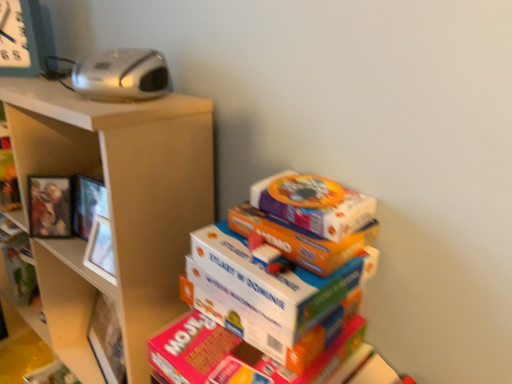
Question: Is wooden shelf at left, the first shelf when ordered from top to bottom, smaller than matte brown shelf at upper left, the 1th shelf ordered from the bottom?

Choices:
 (A) no
 (B) yes

Answer: (B)

Question: Can you confirm if wooden shelf at left, the first shelf when ordered from top to bottom, is shorter than matte brown shelf at upper left, arranged as the 2th shelf when viewed from the top?

Choices:
 (A) yes
 (B) no

Answer: (A)

Question: From the image's perspective, would you say wooden shelf at left, placed as the second shelf when sorted from bottom to top, is shown under matte brown shelf at upper left, arranged as the 2th shelf when viewed from the top?

Choices:
 (A) no
 (B) yes

Answer: (A)

Question: Is wooden shelf at left, the first shelf when ordered from top to bottom, directly adjacent to matte brown shelf at upper left, the 1th shelf ordered from the bottom?

Choices:
 (A) no
 (B) yes

Answer: (A)

Question: Does wooden shelf at left, placed as the second shelf when sorted from bottom to top, contain matte brown shelf at upper left, the 1th shelf ordered from the bottom?

Choices:
 (A) yes
 (B) no

Answer: (B)

Question: Based on their positions, is silver plastic radio at upper left located to the left or right of wooden shelf at left, placed as the second shelf when sorted from bottom to top?

Choices:
 (A) left
 (B) right

Answer: (B)

Question: From the image's perspective, is silver plastic radio at upper left positioned above or below wooden shelf at left, placed as the second shelf when sorted from bottom to top?

Choices:
 (A) below
 (B) above

Answer: (B)

Question: Based on their sizes in the image, would you say silver plastic radio at upper left is bigger or smaller than wooden shelf at left, the first shelf when ordered from top to bottom?

Choices:
 (A) big
 (B) small

Answer: (B)

Question: Choose the correct answer: Is silver plastic radio at upper left inside wooden shelf at left, placed as the second shelf when sorted from bottom to top, or outside it?

Choices:
 (A) outside
 (B) inside

Answer: (A)

Question: Considering the positions of matte brown shelf at upper left, arranged as the 2th shelf when viewed from the top, and wooden shelf at left, placed as the second shelf when sorted from bottom to top, in the image, is matte brown shelf at upper left, arranged as the 2th shelf when viewed from the top, bigger or smaller than wooden shelf at left, placed as the second shelf when sorted from bottom to top,?

Choices:
 (A) small
 (B) big

Answer: (B)

Question: Is matte brown shelf at upper left, arranged as the 2th shelf when viewed from the top, spatially inside wooden shelf at left, the first shelf when ordered from top to bottom, or outside of it?

Choices:
 (A) outside
 (B) inside

Answer: (A)

Question: From the image's perspective, is matte brown shelf at upper left, arranged as the 2th shelf when viewed from the top, above or below wooden shelf at left, placed as the second shelf when sorted from bottom to top?

Choices:
 (A) above
 (B) below

Answer: (B)

Question: In terms of height, does matte brown shelf at upper left, the 1th shelf ordered from the bottom, look taller or shorter compared to wooden shelf at left, placed as the second shelf when sorted from bottom to top?

Choices:
 (A) short
 (B) tall

Answer: (B)

Question: Would you say wooden photo frame at left is to the left or to the right of matte brown shelf at upper left, the 1th shelf ordered from the bottom, in the picture?

Choices:
 (A) left
 (B) right

Answer: (B)

Question: Is wooden photo frame at left inside or outside of matte brown shelf at upper left, the 1th shelf ordered from the bottom?

Choices:
 (A) inside
 (B) outside

Answer: (A)